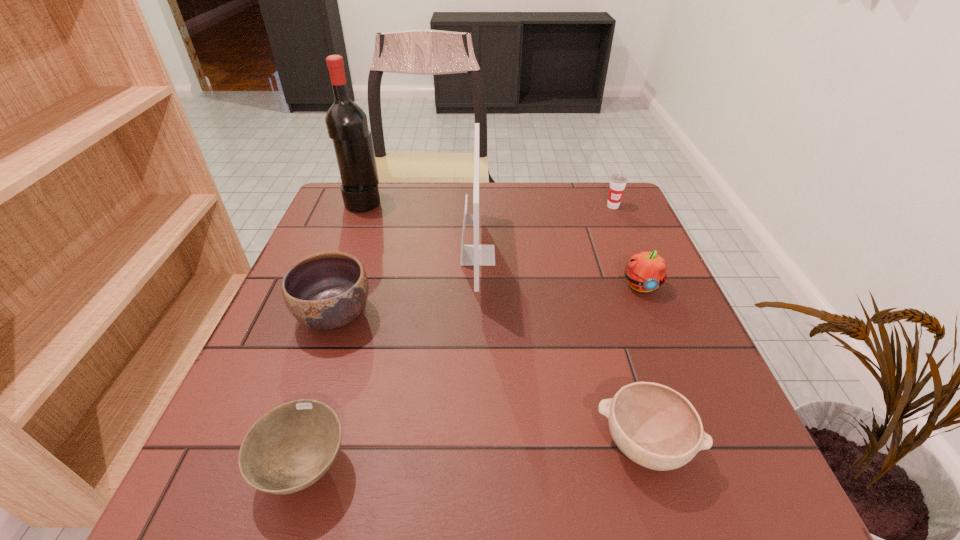
You are a GUI agent. You are given a task and a screenshot of the screen. Output one action in this format:
    pyautogui.click(x=<x>, y=<y>)
    Task: Click on the object positioned at the far left corner
    The image size is (960, 540).
    Given the screenshot: What is the action you would take?
    pyautogui.click(x=346, y=122)

Locate an element on the screen. This screenshot has height=540, width=960. object that is at the near left corner is located at coordinates (292, 446).

The image size is (960, 540). Identify the location of object that is at the far right corner. (618, 182).

Where is `object that is at the near right corner`? This screenshot has width=960, height=540. object that is at the near right corner is located at coordinates (655, 426).

Where is `vacant position at the far edge of the desktop`? The image size is (960, 540). vacant position at the far edge of the desktop is located at coordinates (505, 208).

In order to click on free space at the near edge of the desktop in this screenshot , I will do `click(554, 472)`.

Locate an element on the screen. Image resolution: width=960 pixels, height=540 pixels. vacant space at the left edge of the desktop is located at coordinates (344, 245).

Locate an element on the screen. This screenshot has width=960, height=540. vacant position at the right edge of the desktop is located at coordinates 713,382.

Find the location of a particular element. Image resolution: width=960 pixels, height=540 pixels. free spot at the near left corner of the desktop is located at coordinates (235, 488).

I want to click on vacant space at the far right corner, so 631,212.